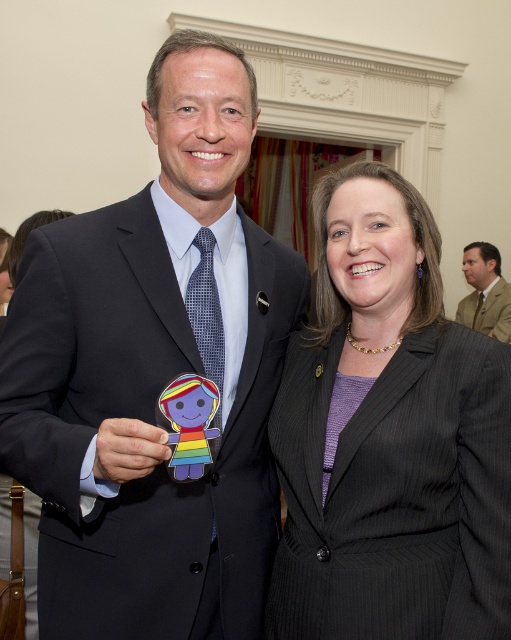
Is black pinstripe suit at center thinner than rainbow paper doll at center?

Incorrect, black pinstripe suit at center's width is not less than rainbow paper doll at center's.

Is black pinstripe suit at center further to the viewer compared to rainbow paper doll at center?

That is True.

Which is in front, point (346, 332) or point (199, 435)?

Positioned in front is point (199, 435).

What are the coordinates of `black pinstripe suit at center` in the screenshot? It's located at (388, 436).

From the picture: Who is positioned more to the left, black pinstripe suit at center or tan fabric suit at right?

Positioned to the left is black pinstripe suit at center.

Is black pinstripe suit at center further to the viewer compared to tan fabric suit at right?

No, it is not.

Identify the location of black pinstripe suit at center. Image resolution: width=511 pixels, height=640 pixels. (388, 436).

Can you confirm if matte black suit at center is positioned below black pinstripe suit at center?

No, matte black suit at center is not below black pinstripe suit at center.

Is point (173, 365) positioned after point (360, 538)?

Yes, it is.

Where is `matte black suit at center`? This screenshot has width=511, height=640. matte black suit at center is located at coordinates (153, 376).